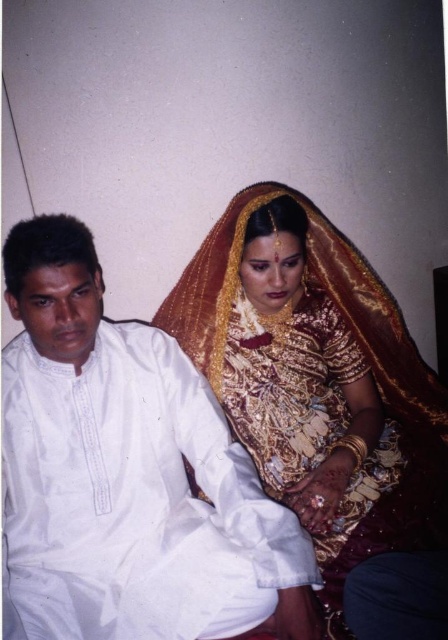
Question: Observing the image, what is the correct spatial positioning of white cotton kurta at left in reference to gold embroidered saree at center?

Choices:
 (A) below
 (B) above

Answer: (A)

Question: Which point appears farthest from the camera in this image?

Choices:
 (A) (116, 426)
 (B) (400, 452)

Answer: (B)

Question: Which object is closer to the camera taking this photo?

Choices:
 (A) gold embroidered saree at center
 (B) white cotton kurta at left

Answer: (B)

Question: Can you confirm if white cotton kurta at left is positioned to the left of gold embroidered saree at center?

Choices:
 (A) yes
 (B) no

Answer: (A)

Question: Is white cotton kurta at left positioned in front of gold embroidered saree at center?

Choices:
 (A) yes
 (B) no

Answer: (A)